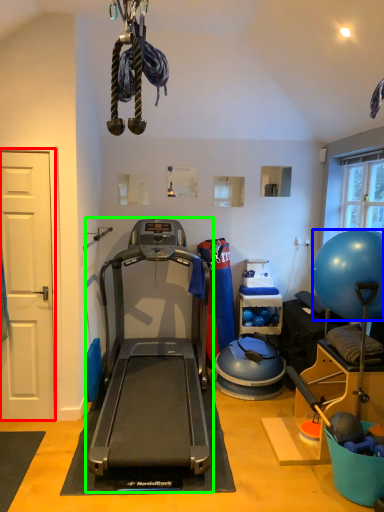
Question: Estimate the real-world distances between objects in this image. Which object is closer to door (highlighted by a red box), ball (highlighted by a blue box) or treadmill (highlighted by a green box)?

Choices:
 (A) ball
 (B) treadmill

Answer: (B)